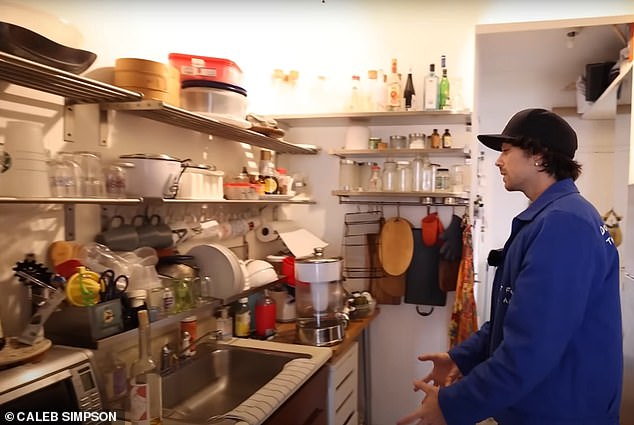
You are a GUI agent. You are given a task and a screenshot of the screen. Output one action in this format:
    pyautogui.click(x=<x>, y=<y>)
    Task: Click on the drawers
    The image size is (634, 425).
    Given the screenshot: What is the action you would take?
    pyautogui.click(x=347, y=368), pyautogui.click(x=347, y=385), pyautogui.click(x=350, y=407)